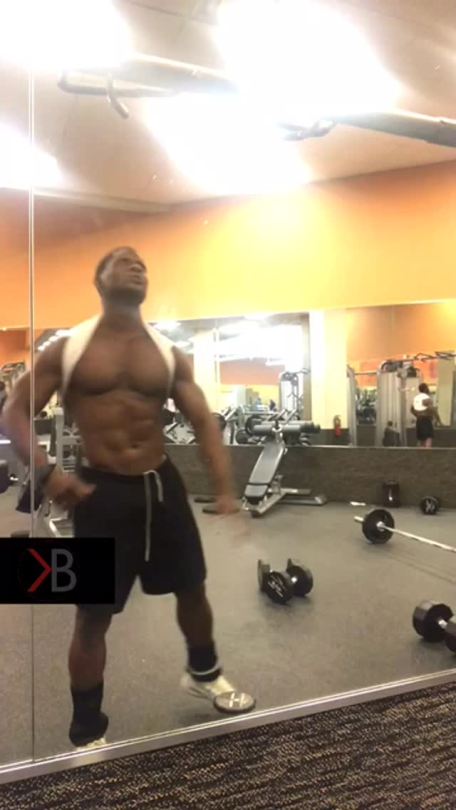
In order to click on wall in this screenshot , I will do `click(383, 249)`.